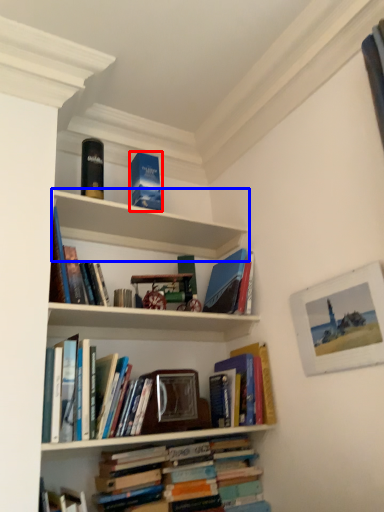
Question: Which point is closer to the camera, paperback book (highlighted by a red box) or shelf (highlighted by a blue box)?

Choices:
 (A) paperback book
 (B) shelf

Answer: (B)